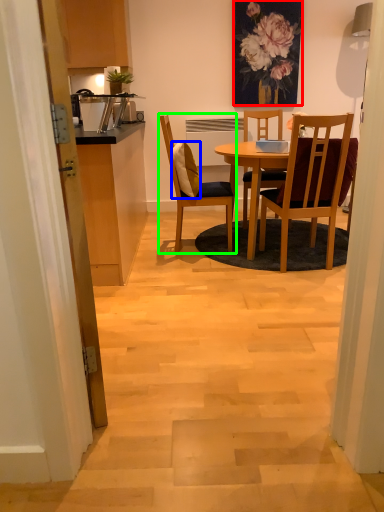
Question: Estimate the real-world distances between objects in this image. Which object is farther from floral arrangement (highlighted by a red box), pillow (highlighted by a blue box) or chair (highlighted by a green box)?

Choices:
 (A) pillow
 (B) chair

Answer: (B)